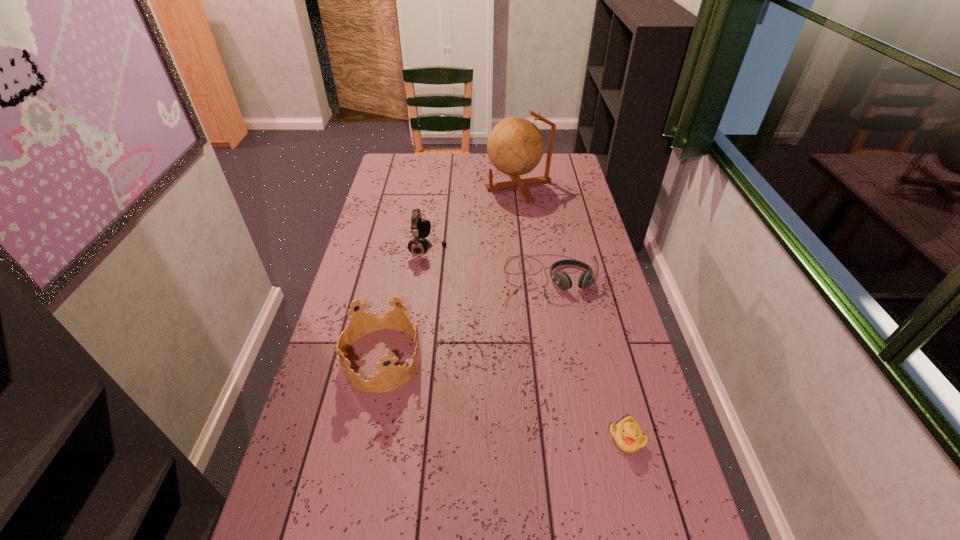
This screenshot has width=960, height=540. I want to click on object positioned at the far right corner, so click(515, 146).

You are a GUI agent. You are given a task and a screenshot of the screen. Output one action in this format:
    pyautogui.click(x=<x>, y=<y>)
    Task: Click on the blank space at the far edge of the desktop
    
    Given the screenshot: What is the action you would take?
    pyautogui.click(x=428, y=154)

Locate an element on the screen. vacant space at the left edge of the desktop is located at coordinates (374, 222).

Where is `vacant space at the right edge`? The height and width of the screenshot is (540, 960). vacant space at the right edge is located at coordinates (649, 399).

Identify the location of free area in between the taller headset and the right headset. (488, 264).

Locate an element on the screen. The height and width of the screenshot is (540, 960). free space between the fourth farthest object and the fourth tallest object is located at coordinates (465, 320).

In order to click on free space between the taller headset and the second nearest object in this screenshot , I will do `click(405, 303)`.

At what (x,y) coordinates should I click in order to perform the action: click on free space between the shortest object and the globe. Please return your answer as a coordinate pair (x, y). The image size is (960, 540). Looking at the image, I should click on (572, 311).

In order to click on vacant space that's between the globe and the left headset in this screenshot , I will do `click(473, 217)`.

Identify the location of vacant space in between the taller headset and the right headset. (488, 264).